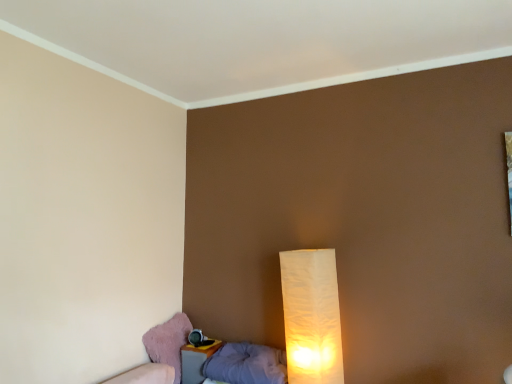
Question: Is pink fabric swivel chair at lower left taller or shorter than matte plastic nightstand at lower left?

Choices:
 (A) short
 (B) tall

Answer: (B)

Question: Is pink fabric swivel chair at lower left situated inside matte plastic nightstand at lower left or outside?

Choices:
 (A) inside
 (B) outside

Answer: (B)

Question: Which of these objects is positioned closest to the white paper lamp at lower right?

Choices:
 (A) pink fabric swivel chair at lower left
 (B) matte plastic nightstand at lower left
 (C) gray fabric pillow at lower left

Answer: (C)

Question: Based on their relative distances, which object is farther from the matte plastic nightstand at lower left?

Choices:
 (A) gray fabric pillow at lower left
 (B) white paper lamp at lower right
 (C) pink fabric swivel chair at lower left

Answer: (B)